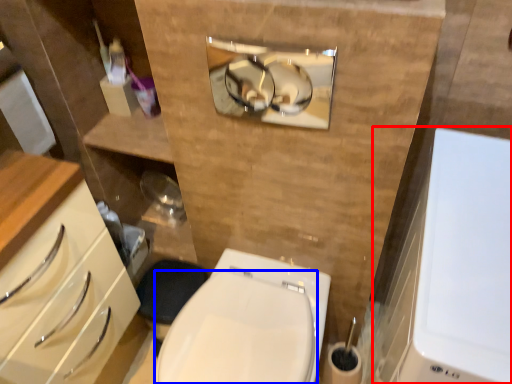
Question: Which of the following is the closest to the observer, medicine cabinet (highlighted by a red box) or bidet (highlighted by a blue box)?

Choices:
 (A) medicine cabinet
 (B) bidet

Answer: (A)